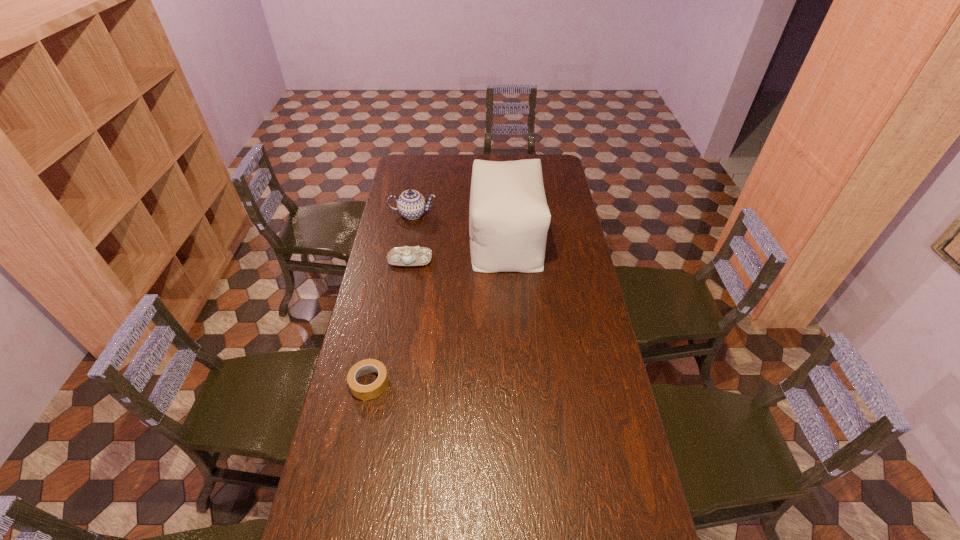
Where is `empty space between the taller chinaware and the tallest object`? empty space between the taller chinaware and the tallest object is located at coordinates (460, 227).

Locate an element on the screen. free spot between the taller chinaware and the second shortest object is located at coordinates (412, 237).

Locate an element on the screen. unoccupied position between the shortest object and the shorter chinaware is located at coordinates (390, 322).

Where is `free space between the tallest object and the farther chinaware`? The height and width of the screenshot is (540, 960). free space between the tallest object and the farther chinaware is located at coordinates (460, 227).

Image resolution: width=960 pixels, height=540 pixels. Identify the location of free point between the nearer chinaware and the nearest object. (390, 322).

The height and width of the screenshot is (540, 960). In order to click on free space between the taller chinaware and the nearer chinaware in this screenshot , I will do `click(412, 237)`.

This screenshot has height=540, width=960. Find the location of `free space that is in between the second tallest object and the tallest object`. free space that is in between the second tallest object and the tallest object is located at coordinates (460, 227).

This screenshot has height=540, width=960. In order to click on vacant area that lies between the duct tape and the taller chinaware in this screenshot , I will do `click(391, 299)`.

The width and height of the screenshot is (960, 540). In order to click on unoccupied position between the nearer chinaware and the cushion in this screenshot , I will do `click(458, 249)`.

Image resolution: width=960 pixels, height=540 pixels. I want to click on the second closest object to the rightmost object, so click(x=411, y=204).